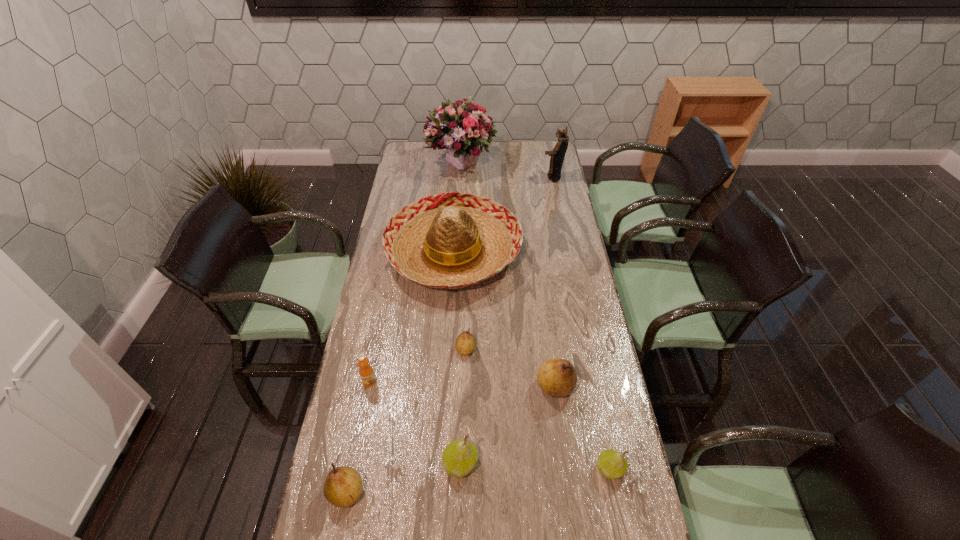
Identify the location of the right green pear. (611, 463).

This screenshot has width=960, height=540. In order to click on the rightmost pear in this screenshot , I will do `click(611, 463)`.

Find the location of `the second brown pear from left to right`. the second brown pear from left to right is located at coordinates (465, 344).

Image resolution: width=960 pixels, height=540 pixels. In order to click on the farthest brown pear in this screenshot , I will do `click(465, 344)`.

Where is `free location located on the front of the pink bouquet`? Image resolution: width=960 pixels, height=540 pixels. free location located on the front of the pink bouquet is located at coordinates (x=460, y=194).

Locate an element on the screen. vacant space located 0.320m on the front-facing side of the figurine is located at coordinates (479, 177).

The width and height of the screenshot is (960, 540). What are the coordinates of `vacant area situated on the front-facing side of the figurine` in the screenshot? It's located at (466, 177).

Where is `vacant space situated on the front-facing side of the figurine`? vacant space situated on the front-facing side of the figurine is located at coordinates (494, 177).

The width and height of the screenshot is (960, 540). In order to click on free location located on the right of the sombrero in this screenshot , I will do `click(576, 253)`.

Locate an element on the screen. This screenshot has width=960, height=540. vacant region located 0.370m on the left of the second pear from right to left is located at coordinates (421, 386).